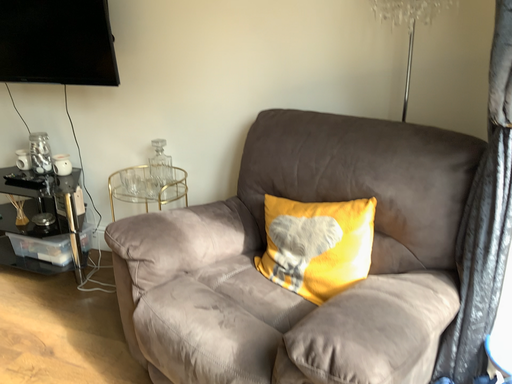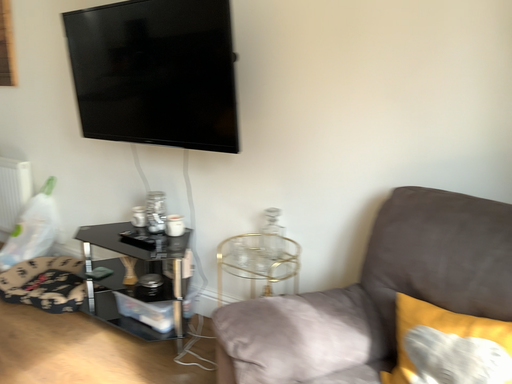
Question: Which way did the camera rotate in the video?

Choices:
 (A) rotated left
 (B) rotated right

Answer: (A)